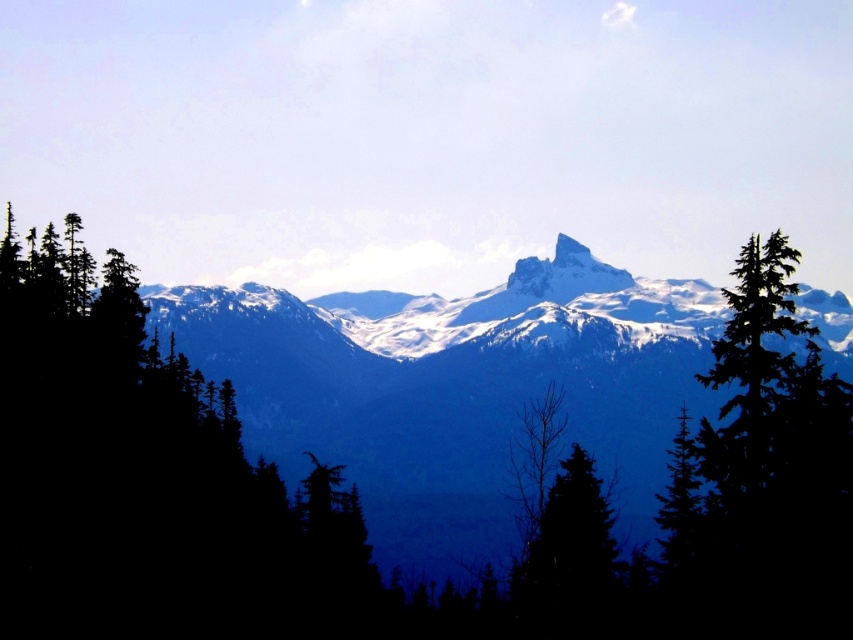
In the scene shown: Is green matte tree at center closer to the viewer compared to green matte tree at lower center?

Yes, it is.

Does green matte tree at center appear over green matte tree at lower center?

Yes.

What do you see at coordinates (149, 483) in the screenshot?
I see `green matte tree at center` at bounding box center [149, 483].

Identify the location of green matte tree at center. Image resolution: width=853 pixels, height=640 pixels. (149, 483).

Can you confirm if green matte tree at center is positioned above white snow-covered peak at center?

No.

This screenshot has height=640, width=853. Describe the element at coordinates (149, 483) in the screenshot. I see `green matte tree at center` at that location.

Does point (94, 456) come behind point (604, 289)?

No, (94, 456) is closer to viewer.

What are the coordinates of `green matte tree at center` in the screenshot? It's located at (149, 483).

Is green matte tree at center below green matte tree at right?

Yes, green matte tree at center is below green matte tree at right.

Measure the distance from green matte tree at center to green matte tree at right.

A distance of 114.92 meters exists between green matte tree at center and green matte tree at right.

Between point (329, 525) and point (778, 380), which one is positioned behind?

Positioned behind is point (329, 525).

This screenshot has width=853, height=640. Find the location of `green matte tree at center`. green matte tree at center is located at coordinates (149, 483).